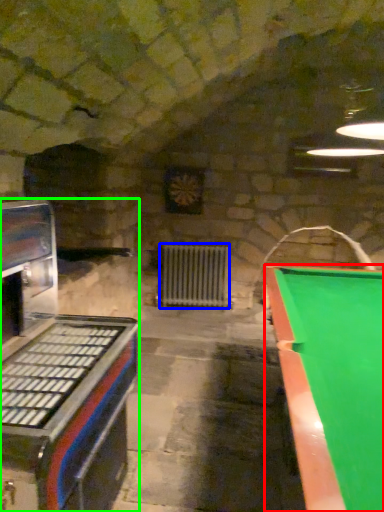
Question: Based on their relative distances, which object is nearer to billiard table (highlighted by a red box)? Choose from radiator (highlighted by a blue box) and appliance (highlighted by a green box).

Choices:
 (A) radiator
 (B) appliance

Answer: (B)